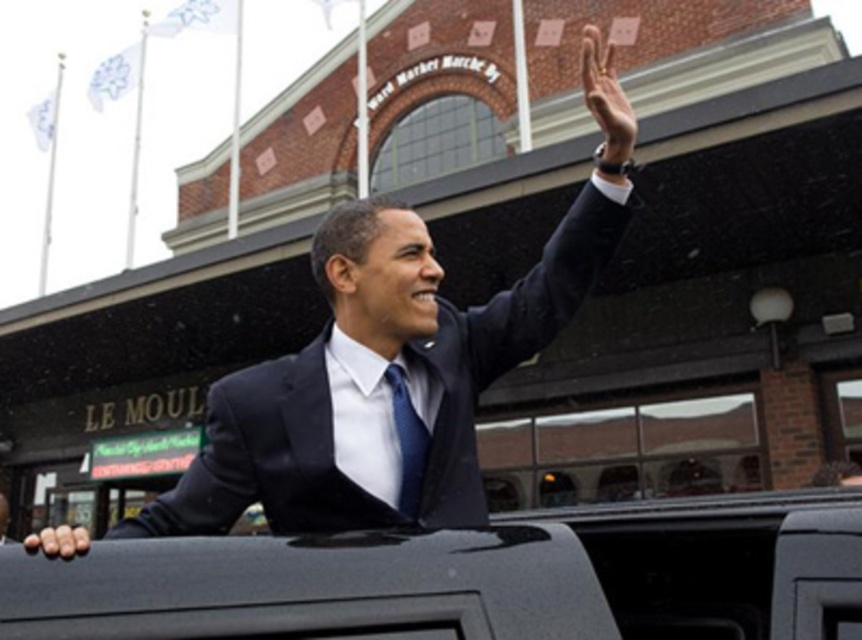
Question: Estimate the real-world distances between objects in this image. Which object is closer to the black matte suit at left?

Choices:
 (A) black matte hand at lower left
 (B) smooth skin hand at upper right

Answer: (A)

Question: Based on their relative distances, which object is nearer to the black matte suit at left?

Choices:
 (A) black matte hand at lower left
 (B) smooth skin hand at upper right

Answer: (A)

Question: Is black matte suit at center behind smooth skin hand at upper right?

Choices:
 (A) no
 (B) yes

Answer: (B)

Question: Among these points, which one is farthest from the camera?

Choices:
 (A) (603, 84)
 (B) (45, 540)
 (C) (292, 410)
 (D) (70, 536)

Answer: (A)

Question: Is black matte suit at center positioned in front of smooth skin hand at upper right?

Choices:
 (A) no
 (B) yes

Answer: (A)

Question: Can you confirm if black matte suit at center is wider than smooth skin hand at upper right?

Choices:
 (A) yes
 (B) no

Answer: (B)